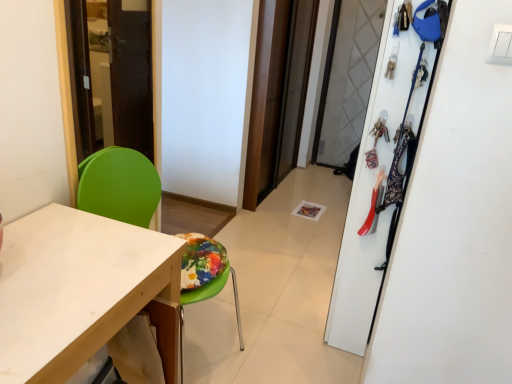
What do you see at coordinates (119, 185) in the screenshot? This screenshot has width=512, height=384. I see `green plastic chair at left` at bounding box center [119, 185].

This screenshot has width=512, height=384. Describe the element at coordinates (80, 291) in the screenshot. I see `white matte desk at lower left` at that location.

Locate an element on the screen. The image size is (512, 384). transparent glass screen door at center is located at coordinates (295, 86).

Describe the element at coordinates (295, 86) in the screenshot. I see `transparent glass screen door at center` at that location.

Where is `white matte closet at upper right`? This screenshot has width=512, height=384. white matte closet at upper right is located at coordinates (371, 197).

What's the angular difference between white matte closet at upper right and transparent glass screen door at center's facing directions?

They differ by 180 degrees in their facing directions.

Is point (408, 110) farther from viewer compared to point (300, 13)?

That is False.

Based on the photo, who is shorter, white matte closet at upper right or transparent glass screen door at center?

With less height is white matte closet at upper right.

Visually, is white matte closet at upper right positioned to the left or to the right of transparent glass screen door at center?

white matte closet at upper right is to the right of transparent glass screen door at center.

Which of these two, white matte closet at upper right or white matte desk at lower left, is bigger?

Bigger between the two is white matte desk at lower left.

From a real-world perspective, is white matte closet at upper right beneath white matte desk at lower left?

Incorrect, from a real-world perspective, white matte closet at upper right is higher than white matte desk at lower left.

You are a GUI agent. You are given a task and a screenshot of the screen. Output one action in this format:
    pyautogui.click(x=<x>, y=<y>)
    Task: Click on the desk on the left side of white matte closet at upper right
    The height and width of the screenshot is (384, 512).
    Given the screenshot: What is the action you would take?
    pyautogui.click(x=80, y=291)

Who is more distant, white matte closet at upper right or white matte desk at lower left?

white matte closet at upper right.

Can you confirm if white matte desk at lower left is positioned to the right of white matte closet at upper right?

No, white matte desk at lower left is not to the right of white matte closet at upper right.

Is white matte desk at lower left next to white matte closet at upper right and touching it?

white matte desk at lower left and white matte closet at upper right are clearly separated.

From the image's perspective, who appears lower, white matte desk at lower left or white matte closet at upper right?

white matte desk at lower left, from the image's perspective.

Between point (23, 341) and point (380, 112), which one is positioned behind?

The point (380, 112) is more distant.

From a real-world perspective, is white matte closet at upper right located beneath green plastic chair at left?

Actually, white matte closet at upper right is physically above green plastic chair at left in the real world.

Based on their sizes in the image, would you say white matte closet at upper right is bigger or smaller than green plastic chair at left?

Clearly, white matte closet at upper right is smaller in size than green plastic chair at left.

Could green plastic chair at left be considered to be inside white matte closet at upper right?

Actually, green plastic chair at left is outside white matte closet at upper right.

In terms of width, does white matte closet at upper right look wider or thinner when compared to green plastic chair at left?

white matte closet at upper right is thinner than green plastic chair at left.

Between green plastic chair at left and white matte closet at upper right, which one has larger width?

With larger width is green plastic chair at left.

Consider the image. Could you tell me if green plastic chair at left is facing white matte closet at upper right?

No, green plastic chair at left is not turned towards white matte closet at upper right.

Which of these two, green plastic chair at left or white matte closet at upper right, stands shorter?

green plastic chair at left.

Visually, is green plastic chair at left positioned to the left or to the right of white matte closet at upper right?

Clearly, green plastic chair at left is on the left of white matte closet at upper right in the image.

From the picture: Which object is positioned more to the right, transparent glass screen door at center or white matte closet at upper right?

white matte closet at upper right.

Can you confirm if transparent glass screen door at center is wider than white matte closet at upper right?

No, transparent glass screen door at center is not wider than white matte closet at upper right.

In the scene shown: Are transparent glass screen door at center and white matte closet at upper right far apart?

Yes, transparent glass screen door at center and white matte closet at upper right are quite far apart.

Who is bigger, transparent glass screen door at center or green plastic chair at left?

With larger size is green plastic chair at left.

From a real-world perspective, is transparent glass screen door at center physically located above or below green plastic chair at left?

In terms of real-world spatial position, transparent glass screen door at center is above green plastic chair at left.

Can we say transparent glass screen door at center lies outside green plastic chair at left?

Absolutely, transparent glass screen door at center is external to green plastic chair at left.

You are a GUI agent. You are given a task and a screenshot of the screen. Output one action in this format:
    pyautogui.click(x=<x>, y=<y>)
    Task: Click on the screen door lying on the right of green plastic chair at left
    
    Given the screenshot: What is the action you would take?
    pyautogui.click(x=295, y=86)

Where is `closet below the transparent glass screen door at center (from the image's perspective)`? closet below the transparent glass screen door at center (from the image's perspective) is located at coordinates (371, 197).

Where is `closet behind the white matte desk at lower left`? closet behind the white matte desk at lower left is located at coordinates (371, 197).

When comparing their distances from white matte closet at upper right, does green plastic chair at left or white matte desk at lower left seem closer?

Based on the image, green plastic chair at left appears to be nearer to white matte closet at upper right.

Considering their positions, is green plastic chair at left positioned closer to white matte desk at lower left than white matte closet at upper right?

green plastic chair at left.

When comparing their distances from transparent glass screen door at center, does white matte desk at lower left or white matte closet at upper right seem closer?

Among the two, white matte closet at upper right is located nearer to transparent glass screen door at center.

Estimate the real-world distances between objects in this image. Which object is closer to green plastic chair at left, transparent glass screen door at center or white matte closet at upper right?

Among the two, white matte closet at upper right is located nearer to green plastic chair at left.

Estimate the real-world distances between objects in this image. Which object is further from green plastic chair at left, white matte closet at upper right or white matte desk at lower left?

white matte closet at upper right is positioned further to the anchor green plastic chair at left.

Which object lies further to the anchor point transparent glass screen door at center, white matte desk at lower left or green plastic chair at left?

white matte desk at lower left lies further to transparent glass screen door at center than the other object.

Estimate the real-world distances between objects in this image. Which object is closer to white matte desk at lower left, white matte closet at upper right or green plastic chair at left?

The object closer to white matte desk at lower left is green plastic chair at left.

Based on their spatial positions, is transparent glass screen door at center or white matte desk at lower left closer to green plastic chair at left?

white matte desk at lower left is closer to green plastic chair at left.

Where is `armchair between white matte desk at lower left and transparent glass screen door at center in the front-back direction`? Image resolution: width=512 pixels, height=384 pixels. armchair between white matte desk at lower left and transparent glass screen door at center in the front-back direction is located at coordinates (119, 185).

The image size is (512, 384). I want to click on closet between white matte desk at lower left and transparent glass screen door at center along the z-axis, so click(x=371, y=197).

What are the coordinates of `armchair between white matte desk at lower left and white matte closet at upper right in the horizontal direction` in the screenshot? It's located at (119, 185).

Where is `closet between green plastic chair at left and transparent glass screen door at center in the front-back direction`? The height and width of the screenshot is (384, 512). closet between green plastic chair at left and transparent glass screen door at center in the front-back direction is located at coordinates (371, 197).